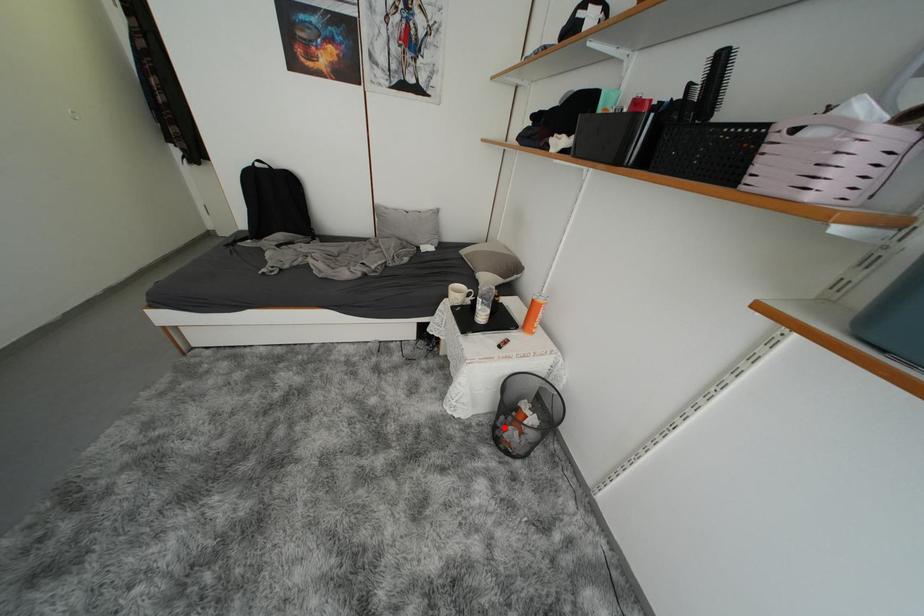
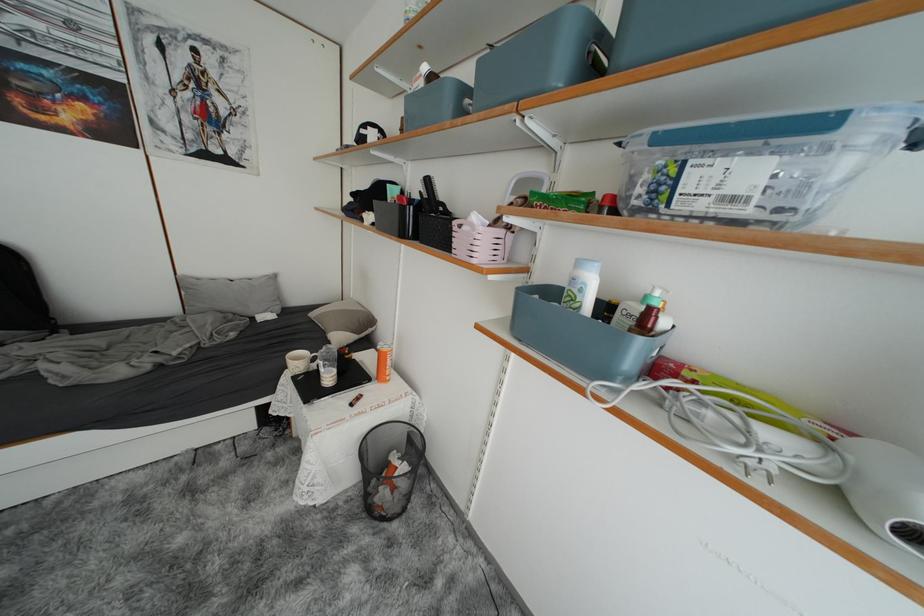
Question: I am providing you with two images of the same scene from different viewpoints. Given a red point in image1, look at the same physical point in image2. Is it:

Choices:
 (A) Closer to the viewpoint
 (B) Farther from the viewpoint

Answer: (A)